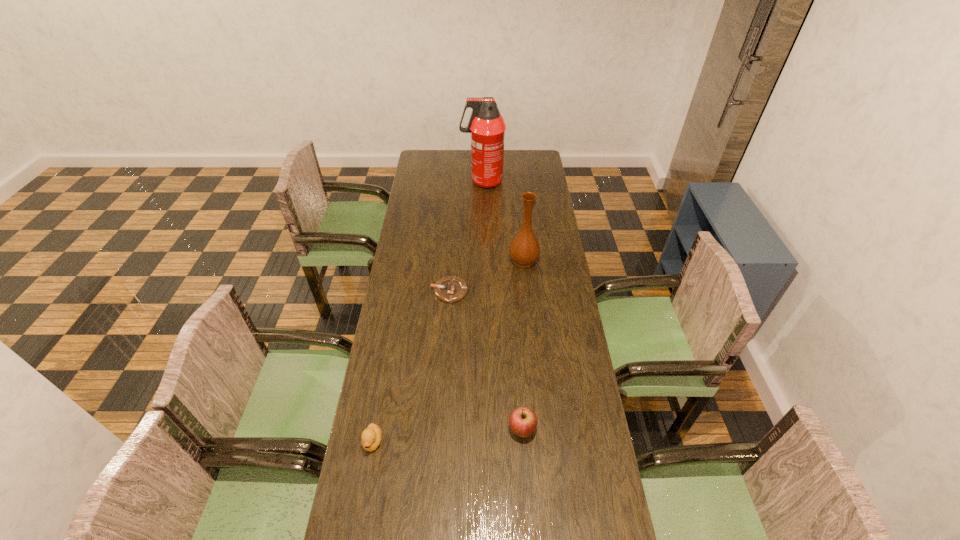
Point out which object is positioned as the fourth nearest to the third shortest object. Please provide its 2D coordinates. Your answer should be formatted as a tuple, i.e. [(x, y)], where the tuple contains the x and y coordinates of a point satisfying the conditions above.

[(487, 127)]

The image size is (960, 540). Identify the location of vacant space that satisfies the following two spatial constraints: 1. on the trigger side of the vase; 2. on the right side of the farthest object. (483, 261).

In order to click on free space that satisfies the following two spatial constraints: 1. on the trigger side of the vase; 2. on the left side of the tallest object in this screenshot , I will do `click(483, 261)`.